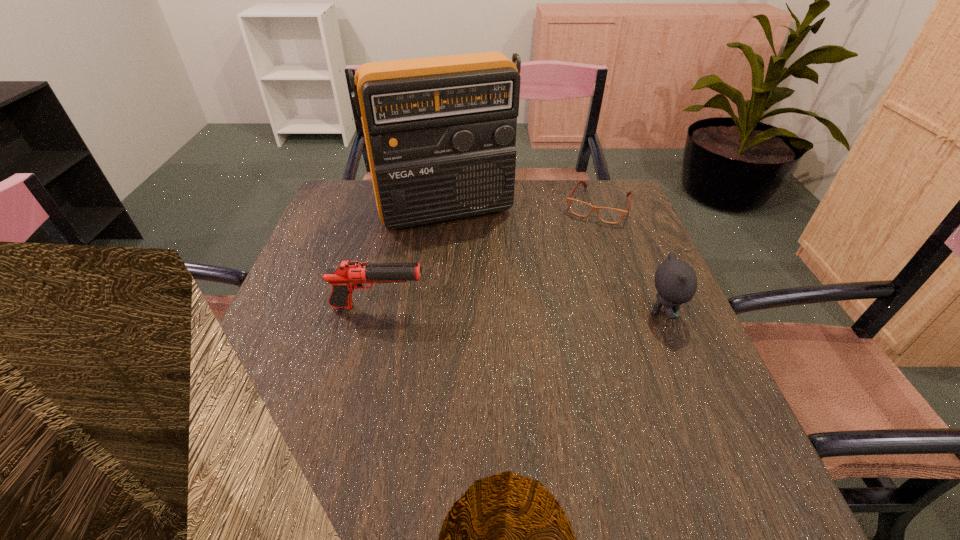
In order to click on empty space that is in between the gun and the kitten in this screenshot , I will do `click(520, 310)`.

Where is `empty space between the kitten and the spectacles`? This screenshot has width=960, height=540. empty space between the kitten and the spectacles is located at coordinates (631, 259).

Locate an element on the screen. vacant point located between the kitten and the gun is located at coordinates (520, 310).

Locate which object ranks third in proximity to the radio receiver. Please provide its 2D coordinates. Your answer should be formatted as a tuple, i.e. [(x, y)], where the tuple contains the x and y coordinates of a point satisfying the conditions above.

[(675, 280)]

Select which object is the closest to the shortest object. Please provide its 2D coordinates. Your answer should be formatted as a tuple, i.e. [(x, y)], where the tuple contains the x and y coordinates of a point satisfying the conditions above.

[(440, 132)]

Where is `free space in the image that satisfies the following two spatial constraints: 1. on the front side of the kitten; 2. on the front-facing side of the spectacles`? Image resolution: width=960 pixels, height=540 pixels. free space in the image that satisfies the following two spatial constraints: 1. on the front side of the kitten; 2. on the front-facing side of the spectacles is located at coordinates (636, 313).

Locate an element on the screen. The width and height of the screenshot is (960, 540). free location that satisfies the following two spatial constraints: 1. on the back side of the tallest object; 2. on the right side of the spectacles is located at coordinates (446, 206).

The width and height of the screenshot is (960, 540). Find the location of `free space that satisfies the following two spatial constraints: 1. on the front side of the kitten; 2. on the front-facing side of the radio receiver`. free space that satisfies the following two spatial constraints: 1. on the front side of the kitten; 2. on the front-facing side of the radio receiver is located at coordinates (435, 313).